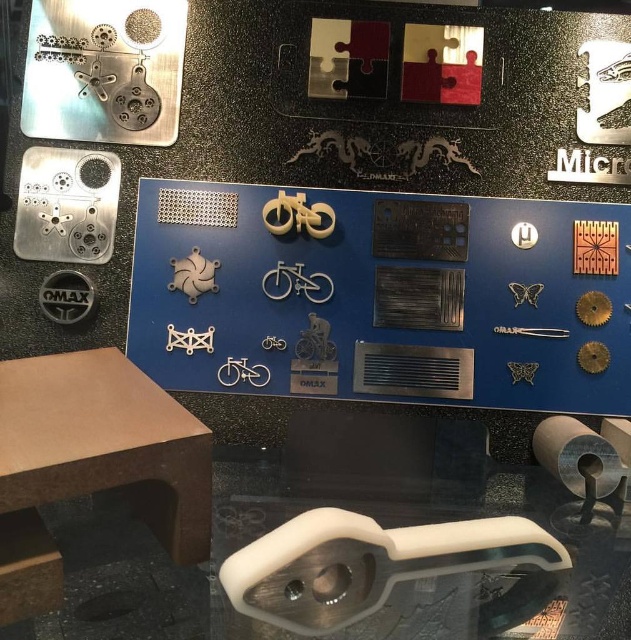
Which is more to the left, transparent plastic handle at lower center or brown matte table at lower left?

brown matte table at lower left is more to the left.

Can you confirm if transparent plastic handle at lower center is positioned to the right of brown matte table at lower left?

Indeed, transparent plastic handle at lower center is positioned on the right side of brown matte table at lower left.

The image size is (631, 640). Find the location of `transparent plastic handle at lower center`. transparent plastic handle at lower center is located at coordinates (221, 548).